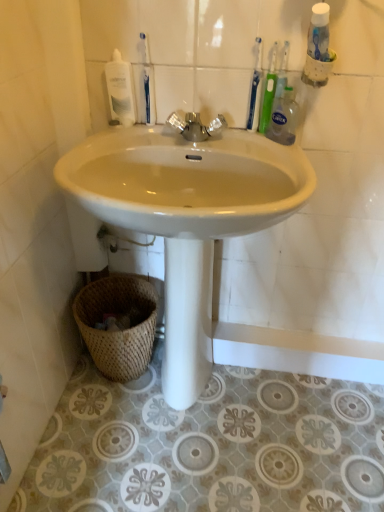
Describe the element at coordinates (196, 126) in the screenshot. I see `silver metallic faucet at center` at that location.

Looking at this image, in order to face white glossy mouthwash at upper left, should I rotate leftwards or rightwards?

You should look left and rotate roughly 9.726 degrees.

Describe the element at coordinates (187, 217) in the screenshot. The height and width of the screenshot is (512, 384). I see `white glossy sink at center` at that location.

The width and height of the screenshot is (384, 512). Describe the element at coordinates (283, 118) in the screenshot. I see `clear plastic bottle at upper right` at that location.

Locate an element on the screen. blue plastic toothbrush at upper center, which appears as the 1th toothbrush when viewed from the left is located at coordinates (148, 84).

This screenshot has height=512, width=384. What are the coordinates of `silver metallic faucet at center` in the screenshot? It's located at (196, 126).

Considering the relative positions of white glossy sink at center and woven natural basket at lower left in the image provided, is white glossy sink at center to the left of woven natural basket at lower left from the viewer's perspective?

No, white glossy sink at center is not to the left of woven natural basket at lower left.

Are white glossy sink at center and woven natural basket at lower left far apart?

No, white glossy sink at center is not far away from woven natural basket at lower left.

Is white glossy sink at center positioned with its back to woven natural basket at lower left?

Absolutely, white glossy sink at center is directed away from woven natural basket at lower left.

From a real-world perspective, which object stands above the other?

From a 3D spatial view, white glossy sink at center is above.

Between white glossy sink at center and white glossy mouthwash at upper left, which one has smaller size?

Smaller between the two is white glossy mouthwash at upper left.

Is white glossy sink at center far away from white glossy mouthwash at upper left?

white glossy sink at center is actually quite close to white glossy mouthwash at upper left.

From a real-world perspective, between white glossy sink at center and white glossy mouthwash at upper left, who is vertically higher?

In real-world perspective, white glossy mouthwash at upper left is above.

Based on the photo, does blue plastic toothbrush at upper center, which appears as the third toothbrush when viewed from the right, have a smaller size compared to blue plastic toothbrush at upper right, the second toothbrush positioned from the left?

Yes, blue plastic toothbrush at upper center, which appears as the third toothbrush when viewed from the right, is smaller than blue plastic toothbrush at upper right, the second toothbrush positioned from the left.

Image resolution: width=384 pixels, height=512 pixels. In the image, there is a blue plastic toothbrush at upper right, acting as the second toothbrush starting from the right. In order to click on toothbrush below it (from a real-world perspective) in this screenshot , I will do `click(148, 84)`.

Which of these two, blue plastic toothbrush at upper center, which appears as the third toothbrush when viewed from the right, or blue plastic toothbrush at upper right, acting as the second toothbrush starting from the right, stands shorter?

Standing shorter between the two is blue plastic toothbrush at upper center, which appears as the third toothbrush when viewed from the right.

Consider the image. Is blue plastic toothbrush at upper center, which appears as the third toothbrush when viewed from the right, at the left side of blue plastic toothbrush at upper right, the second toothbrush positioned from the left?

Correct, you'll find blue plastic toothbrush at upper center, which appears as the third toothbrush when viewed from the right, to the left of blue plastic toothbrush at upper right, the second toothbrush positioned from the left.

Is blue plastic toothbrush at upper right, the second toothbrush positioned from the left, to the left of blue plastic toothbrush at upper center, which appears as the third toothbrush when viewed from the right, from the viewer's perspective?

No.

Can blue plastic toothbrush at upper center, which appears as the third toothbrush when viewed from the right, be found inside blue plastic toothbrush at upper right, acting as the second toothbrush starting from the right?

That's incorrect, blue plastic toothbrush at upper center, which appears as the third toothbrush when viewed from the right, is not inside blue plastic toothbrush at upper right, acting as the second toothbrush starting from the right.

Between blue plastic toothbrush at upper right, acting as the second toothbrush starting from the right, and blue plastic toothbrush at upper center, which appears as the 1th toothbrush when viewed from the left, which one is positioned in front?

blue plastic toothbrush at upper right, acting as the second toothbrush starting from the right, is in front.

Are white glossy sink at center and silver metallic faucet at center far apart?

No, white glossy sink at center is in close proximity to silver metallic faucet at center.

Which object is wider, white glossy sink at center or silver metallic faucet at center?

With larger width is white glossy sink at center.

Is white glossy sink at center aimed at silver metallic faucet at center?

No, white glossy sink at center is not aimed at silver metallic faucet at center.

Which of these two, white glossy sink at center or silver metallic faucet at center, is smaller?

With smaller size is silver metallic faucet at center.

From the image's perspective, is blue plastic toothbrush at upper right, the second toothbrush positioned from the left, above or below woven natural basket at lower left?

Clearly, from the image's perspective, blue plastic toothbrush at upper right, the second toothbrush positioned from the left, is above woven natural basket at lower left.

Is blue plastic toothbrush at upper right, acting as the second toothbrush starting from the right, outside of woven natural basket at lower left?

Yes.

Is blue plastic toothbrush at upper right, acting as the second toothbrush starting from the right, taller than woven natural basket at lower left?

Incorrect, the height of blue plastic toothbrush at upper right, acting as the second toothbrush starting from the right, is not larger of that of woven natural basket at lower left.

Is white glossy mouthwash at upper left wider or thinner than white glossy sink at center?

In the image, white glossy mouthwash at upper left appears to be more narrow than white glossy sink at center.

Choose the correct answer: Is white glossy mouthwash at upper left inside white glossy sink at center or outside it?

white glossy mouthwash at upper left is not inside white glossy sink at center, it's outside.

Who is taller, white glossy mouthwash at upper left or white glossy sink at center?

white glossy sink at center is taller.

Is white glossy mouthwash at upper left at the left side of white glossy sink at center?

Yes, white glossy mouthwash at upper left is to the left of white glossy sink at center.

Locate an element on the screen. basket below the white glossy sink at center (from the image's perspective) is located at coordinates (120, 331).

Where is `mouthwash behind the white glossy sink at center`? This screenshot has height=512, width=384. mouthwash behind the white glossy sink at center is located at coordinates (120, 90).

Looking at the image, which one is located further to white glossy mouthwash at upper left, green plastic toothbrush at upper right, which is the 3th toothbrush from left to right, or blue plastic toothbrush at upper right, the second toothbrush positioned from the left?

The object further to white glossy mouthwash at upper left is green plastic toothbrush at upper right, which is the 3th toothbrush from left to right.

Based on their spatial positions, is woven natural basket at lower left or blue plastic toothbrush at upper center, which appears as the 1th toothbrush when viewed from the left, closer to green plastic toothbrush at upper right, which is the 3th toothbrush from left to right?

Among the two, blue plastic toothbrush at upper center, which appears as the 1th toothbrush when viewed from the left, is located nearer to green plastic toothbrush at upper right, which is the 3th toothbrush from left to right.

Looking at this image, when comparing their distances from woven natural basket at lower left, does blue plastic toothbrush at upper center, which appears as the 1th toothbrush when viewed from the left, or clear plastic bottle at upper right seem closer?

Among the two, blue plastic toothbrush at upper center, which appears as the 1th toothbrush when viewed from the left, is located nearer to woven natural basket at lower left.

Which object lies further to the anchor point silver metallic faucet at center, clear plastic bottle at upper right or white glossy mouthwash at upper left?

Among the two, clear plastic bottle at upper right is located further to silver metallic faucet at center.

Considering their positions, is woven natural basket at lower left positioned further to clear plastic bottle at upper right than green plastic toothbrush at upper right, the 1th toothbrush when ordered from right to left?

woven natural basket at lower left is further to clear plastic bottle at upper right.

Considering their positions, is clear plastic bottle at upper right positioned further to blue plastic toothbrush at upper right, acting as the second toothbrush starting from the right, than silver metallic faucet at center?

silver metallic faucet at center lies further to blue plastic toothbrush at upper right, acting as the second toothbrush starting from the right, than the other object.

When comparing their distances from green plastic toothbrush at upper right, which is the 3th toothbrush from left to right, does white glossy mouthwash at upper left or white glossy sink at center seem further?

The object further to green plastic toothbrush at upper right, which is the 3th toothbrush from left to right, is white glossy sink at center.

Estimate the real-world distances between objects in this image. Which object is further from white glossy mouthwash at upper left, white glossy sink at center or blue plastic toothbrush at upper right, the second toothbrush positioned from the left?

white glossy sink at center is positioned further to the anchor white glossy mouthwash at upper left.

In order to click on sink between silver metallic faucet at center and woven natural basket at lower left in the up-down direction in this screenshot , I will do `click(187, 217)`.

Locate an element on the screen. The image size is (384, 512). cleaning product between blue plastic toothbrush at upper right, the second toothbrush positioned from the left, and white glossy sink at center vertically is located at coordinates (283, 118).

The height and width of the screenshot is (512, 384). I want to click on tap between blue plastic toothbrush at upper center, which appears as the third toothbrush when viewed from the right, and clear plastic bottle at upper right from left to right, so click(196, 126).

At what (x,y) coordinates should I click in order to perform the action: click on sink between blue plastic toothbrush at upper center, which appears as the third toothbrush when viewed from the right, and woven natural basket at lower left vertically. Please return your answer as a coordinate pair (x, y). Looking at the image, I should click on (187, 217).